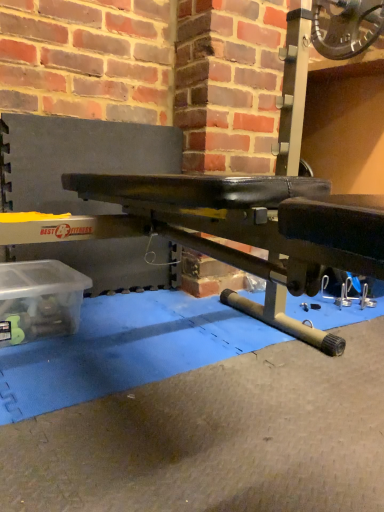
Describe the element at coordinates (39, 300) in the screenshot. I see `transparent plastic container at lower left` at that location.

Locate an element on the screen. transparent plastic container at lower left is located at coordinates (39, 300).

Image resolution: width=384 pixels, height=512 pixels. I want to click on transparent plastic container at lower left, so click(39, 300).